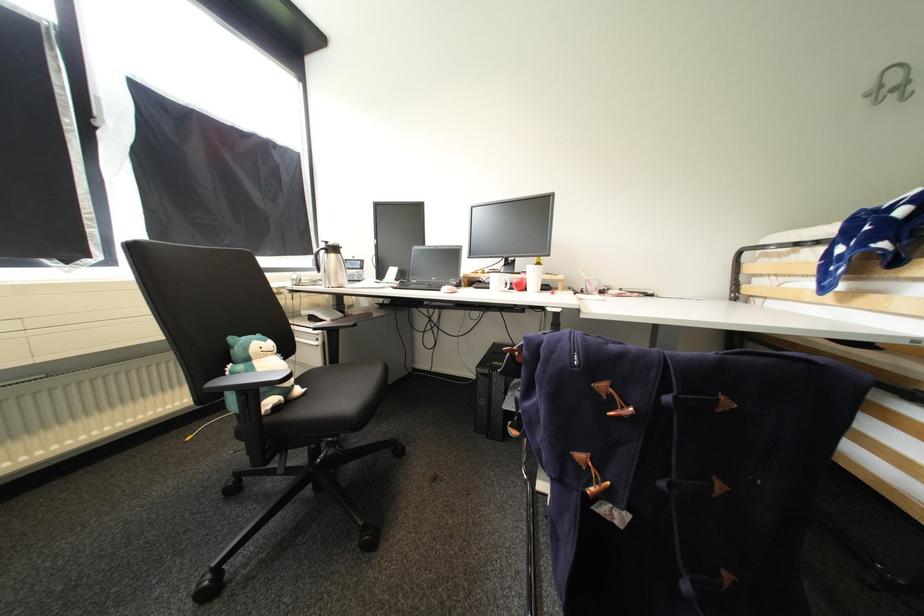
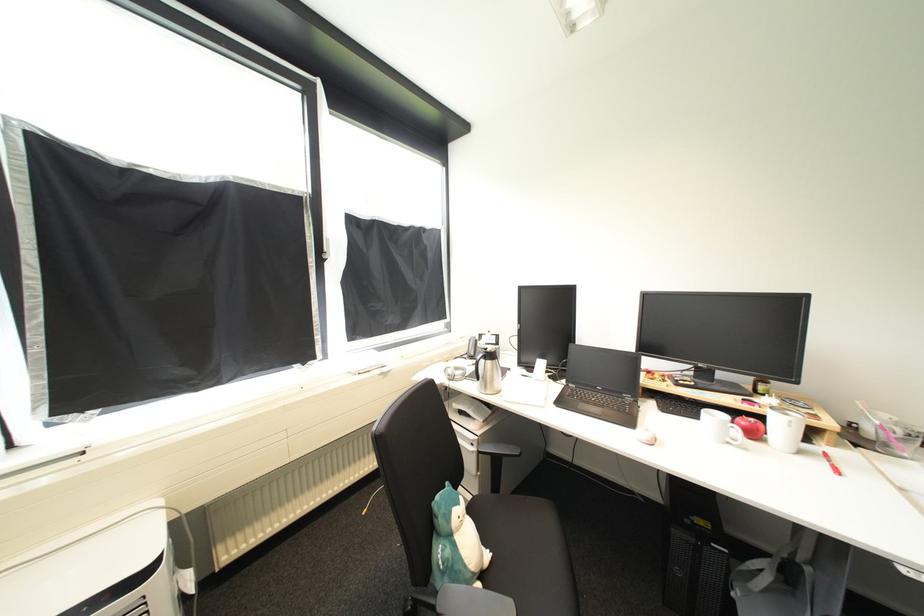
In the second image, find the point that corresponds to point 517,395 in the first image.

(745, 591)